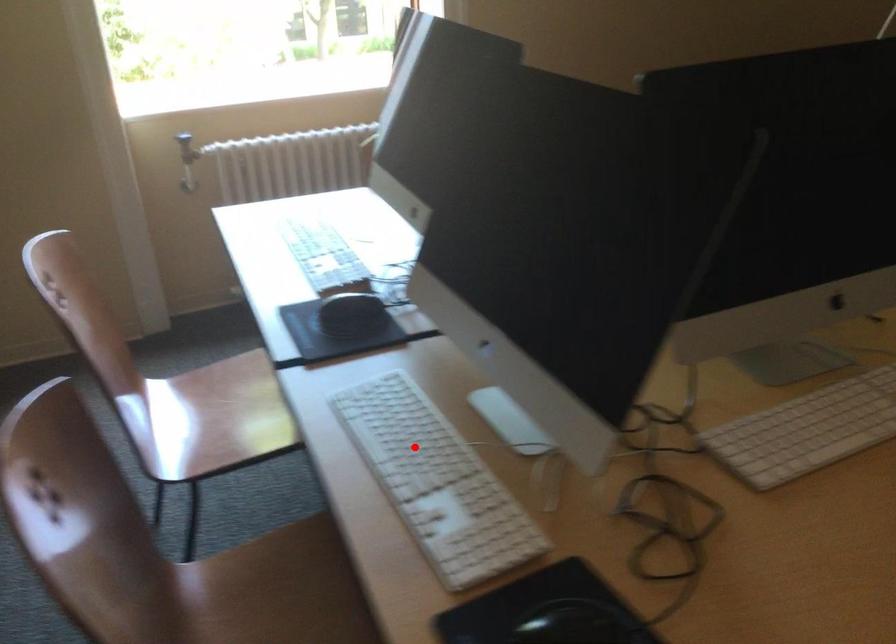
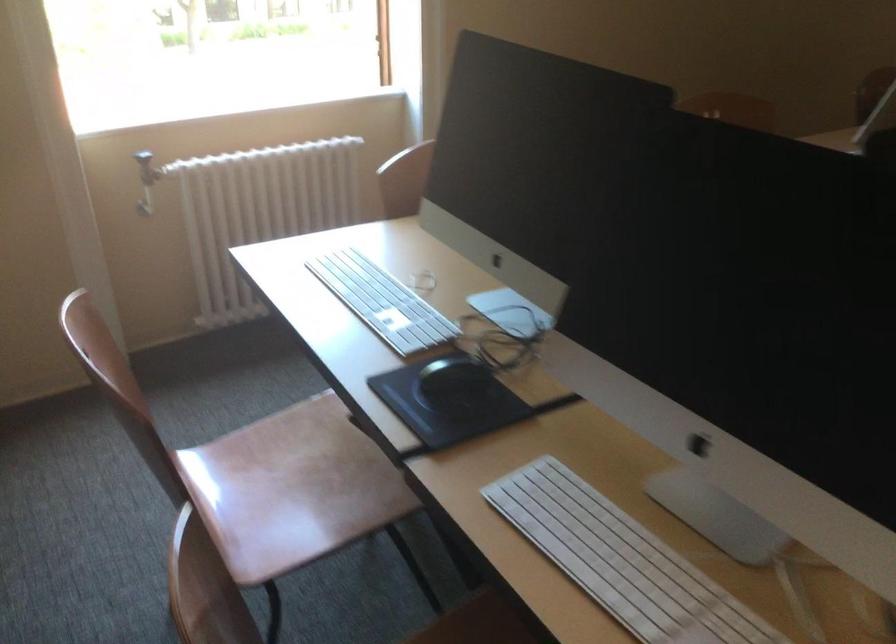
Question: A red point is marked in image1. In image2, is the corresponding 3D point closer to the camera or farther? Reply with the corresponding letter.

Choices:
 (A) The corresponding 3D point is closer.
 (B) The corresponding 3D point is farther.

Answer: (A)